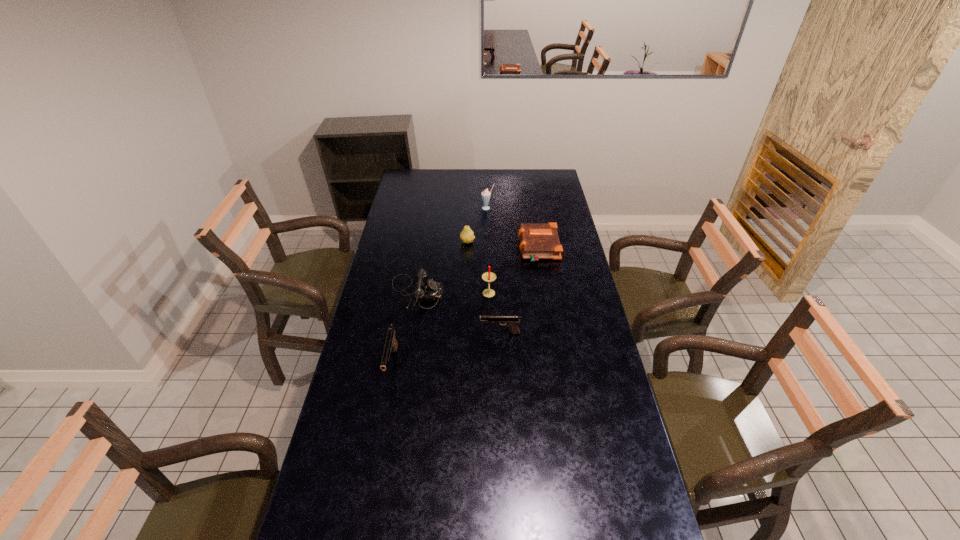
Find the location of a particular element. free spot between the farthest object and the shorter pistol is located at coordinates (493, 271).

I want to click on vacant space in between the shorter pistol and the fifth object from right to left, so click(484, 288).

What are the coordinates of `free spot between the nearest object and the pear` in the screenshot? It's located at (x=430, y=303).

Image resolution: width=960 pixels, height=540 pixels. I want to click on vacant point located between the nearest object and the candle, so click(x=441, y=329).

At what (x,y) coordinates should I click in order to perform the action: click on vacant area that lies between the telephone and the third object from left to right. Please return your answer as a coordinate pair (x, y). This screenshot has width=960, height=540. Looking at the image, I should click on (443, 267).

You are a GUI agent. You are given a task and a screenshot of the screen. Output one action in this format:
    pyautogui.click(x=<x>, y=<y>)
    Task: Click on the free spot between the candle and the pear
    
    Given the screenshot: What is the action you would take?
    pyautogui.click(x=478, y=268)

This screenshot has height=540, width=960. What are the coordinates of `vacant region between the candle and the telephone` in the screenshot? It's located at (453, 294).

Locate which object is the fifth closest to the rightmost object. Please provide its 2D coordinates. Your answer should be formatted as a tuple, i.e. [(x, y)], where the tuple contains the x and y coordinates of a point satisfying the conditions above.

[(512, 322)]

Where is `object that stands as the second closest to the milkshake`? The width and height of the screenshot is (960, 540). object that stands as the second closest to the milkshake is located at coordinates (467, 236).

This screenshot has width=960, height=540. I want to click on free location that satisfies the following two spatial constraints: 1. on the spine side of the shortest object; 2. at the muzzle of the taller pistol, so click(x=558, y=364).